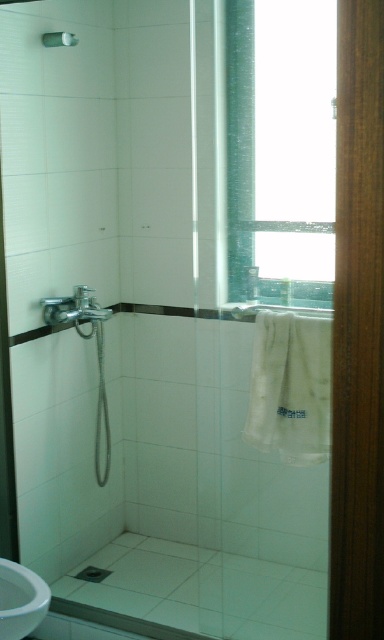
Is white glossy sink at lower left above silver metallic towel bar at upper center?

Incorrect, white glossy sink at lower left is not positioned above silver metallic towel bar at upper center.

Is white glossy sink at lower left closer to the viewer compared to silver metallic towel bar at upper center?

Yes, it is in front of silver metallic towel bar at upper center.

At what (x,y) coordinates should I click in order to perform the action: click on white glossy sink at lower left. Please return your answer as a coordinate pair (x, y). The height and width of the screenshot is (640, 384). Looking at the image, I should click on (21, 600).

Between point (317, 269) and point (97, 308), which one is positioned behind?

Point (97, 308)

Does transparent glass window at upper center come behind brushed metal faucet at left?

No.

Is point (258, 61) positioned after point (66, 310)?

That is True.

Identify the location of transparent glass window at upper center. The width and height of the screenshot is (384, 640). (281, 150).

Locate an element on the screen. The width and height of the screenshot is (384, 640). brushed metal faucet at left is located at coordinates (74, 308).

Is brushed metal faucet at left smaller than silver metallic towel bar at upper center?

Actually, brushed metal faucet at left might be larger than silver metallic towel bar at upper center.

Find the location of a particular element. This screenshot has width=384, height=640. brushed metal faucet at left is located at coordinates (74, 308).

Locate an element on the screen. The height and width of the screenshot is (640, 384). brushed metal faucet at left is located at coordinates (74, 308).